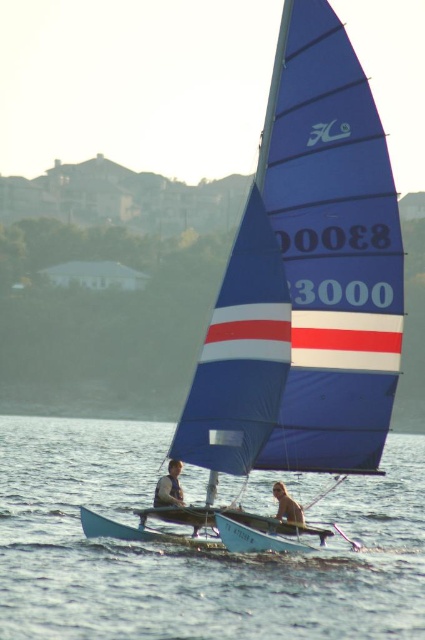
You are standing on the deck of the catamaran and want to retrieve your belongings. You see the light brown leather jacket at lower left and the brown fur dog at center. Which item is closer to you?

The light brown leather jacket at lower left is closer to you because it is further to the viewer than the brown fur dog at center.